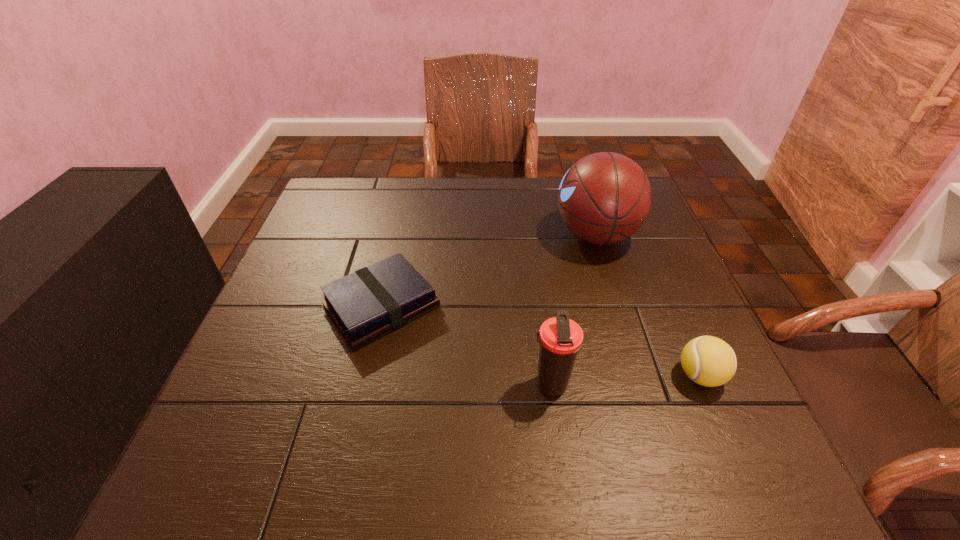
You are a GUI agent. You are given a task and a screenshot of the screen. Output one action in this format:
    pyautogui.click(x=<x>, y=<y>)
    Task: Click on the object that is the closest to the tennis ball
    Image resolution: width=960 pixels, height=540 pixels.
    Given the screenshot: What is the action you would take?
    pyautogui.click(x=560, y=338)

Locate an element on the screen. Image resolution: width=960 pixels, height=540 pixels. object that is the closest one to the shortest object is located at coordinates coord(560,338).

The image size is (960, 540). In order to click on free space that satisfies the following two spatial constraints: 1. on the front side of the tennis ball; 2. on the right side of the farthest object in this screenshot , I will do `click(639, 376)`.